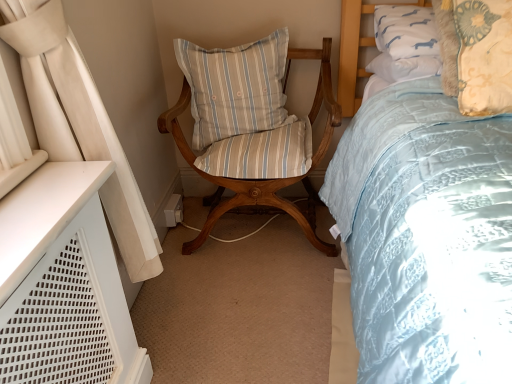
Question: From the image's perspective, does light blue striped cushion at center, arranged as the second pillow when viewed from the right, appear higher than wooden chair with striped cushion at center?

Choices:
 (A) yes
 (B) no

Answer: (A)

Question: Considering the relative positions of light blue striped cushion at center, which is counted as the 1th pillow, starting from the back, and wooden chair with striped cushion at center in the image provided, is light blue striped cushion at center, which is counted as the 1th pillow, starting from the back, to the left of wooden chair with striped cushion at center from the viewer's perspective?

Choices:
 (A) yes
 (B) no

Answer: (A)

Question: From a real-world perspective, does light blue striped cushion at center, the first pillow positioned from the left, stand above wooden chair with striped cushion at center?

Choices:
 (A) yes
 (B) no

Answer: (A)

Question: Can you confirm if light blue striped cushion at center, acting as the second pillow starting from the front, is taller than wooden chair with striped cushion at center?

Choices:
 (A) no
 (B) yes

Answer: (A)

Question: Is light blue striped cushion at center, the first pillow positioned from the left, wider than wooden chair with striped cushion at center?

Choices:
 (A) yes
 (B) no

Answer: (B)

Question: Is light blue striped cushion at center, which is counted as the 1th pillow, starting from the back, positioned behind wooden chair with striped cushion at center?

Choices:
 (A) no
 (B) yes

Answer: (B)

Question: Would you say floral-patterned fabric pillow at upper right, arranged as the 1th pillow when viewed from the right, is outside light blue striped cushion at center, the first pillow positioned from the left?

Choices:
 (A) no
 (B) yes

Answer: (B)

Question: Is floral-patterned fabric pillow at upper right, placed as the first pillow when sorted from front to back, smaller than light blue striped cushion at center, arranged as the second pillow when viewed from the right?

Choices:
 (A) no
 (B) yes

Answer: (B)

Question: Are floral-patterned fabric pillow at upper right, the second pillow viewed from the left, and light blue striped cushion at center, which is counted as the 1th pillow, starting from the back, far apart?

Choices:
 (A) no
 (B) yes

Answer: (A)

Question: Is floral-patterned fabric pillow at upper right, arranged as the 1th pillow when viewed from the right, to the right of light blue striped cushion at center, acting as the second pillow starting from the front, from the viewer's perspective?

Choices:
 (A) yes
 (B) no

Answer: (A)

Question: Does floral-patterned fabric pillow at upper right, arranged as the 1th pillow when viewed from the right, have a greater height compared to light blue striped cushion at center, acting as the second pillow starting from the front?

Choices:
 (A) yes
 (B) no

Answer: (B)

Question: From a real-world perspective, is floral-patterned fabric pillow at upper right, placed as the first pillow when sorted from front to back, over light blue striped cushion at center, arranged as the second pillow when viewed from the right?

Choices:
 (A) yes
 (B) no

Answer: (A)

Question: From the image's perspective, is floral-patterned fabric pillow at upper right, which appears as the 2th pillow when viewed from the back, located beneath wooden chair with striped cushion at center?

Choices:
 (A) no
 (B) yes

Answer: (A)